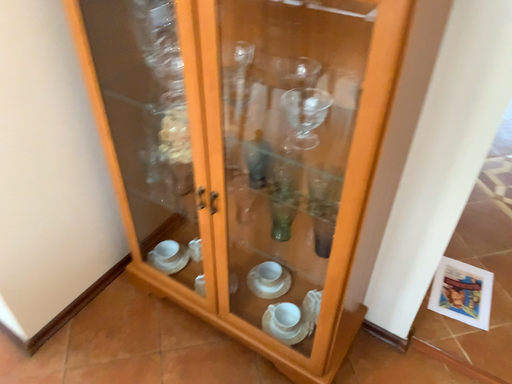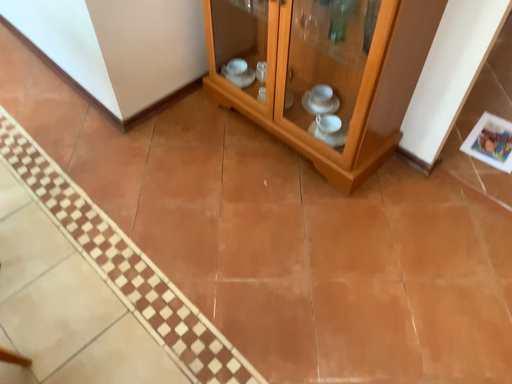
Question: Which way did the camera rotate in the video?

Choices:
 (A) rotated right
 (B) rotated left

Answer: (B)